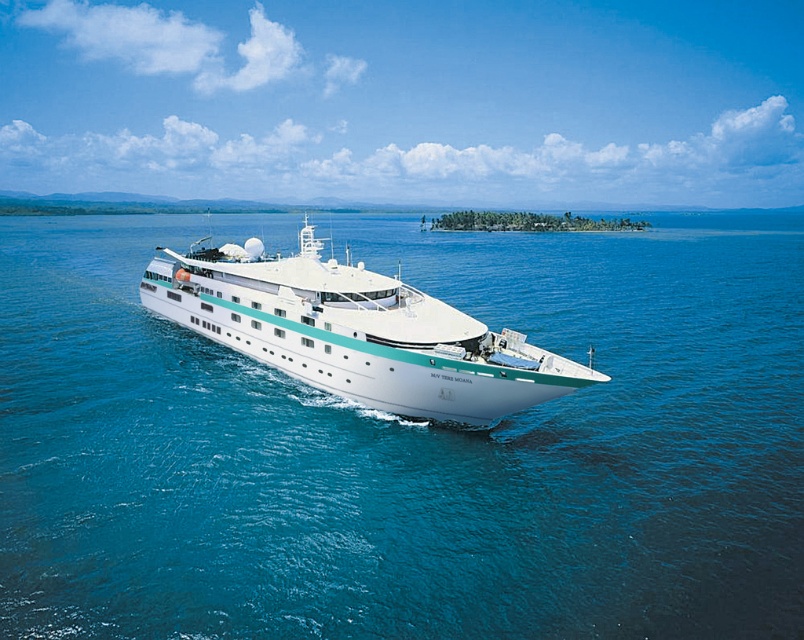
You are standing on the deck of the cruise ship and looking out towards the horizon. Which object, the blue water at center or the white glossy cruise ship at center, is positioned to the left of the other?

The blue water at center is to the left of the white glossy cruise ship at center, according to the description provided.

Based on the photo, you are standing on the deck of the MV Tere Moana and notice two points marked on the ocean surface. The first point is at coordinates point [659,374] and the second is at point [482,397]. Which point is closer to you?

Point [659,374] is further to the viewer than point [482,397], so the point closer to you is point [482,397].

You are a passenger on the cruise ship and want to take a photo of the ocean from the deck. Since the white glossy cruise ship at center is blocking your view, where should you move to get an unobstructed view of the blue water at center?

The blue water at center is positioned under the white glossy cruise ship at center, so you should move to a lower deck or position yourself behind the ship to avoid the obstruction and see the blue water at center.